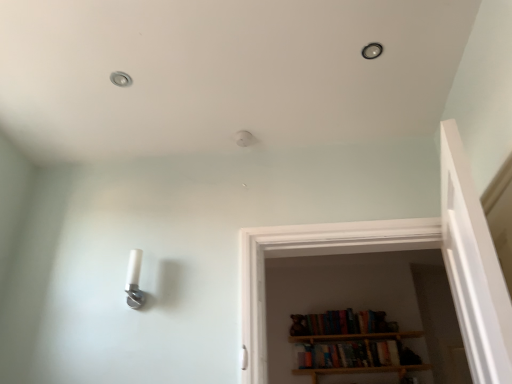
Locate an element on the screen. Image resolution: width=512 pixels, height=384 pixels. metallic ceiling light at upper left is located at coordinates (121, 79).

Image resolution: width=512 pixels, height=384 pixels. In order to click on wooden bookshelf at center in this screenshot , I will do `click(348, 354)`.

Does white plastic light fixture at lower left have a greater height compared to metallic ceiling light at upper left?

Yes.

Which is more to the right, white plastic light fixture at lower left or metallic ceiling light at upper left?

white plastic light fixture at lower left.

Which of these two, white plastic light fixture at lower left or metallic ceiling light at upper left, is bigger?

With larger size is white plastic light fixture at lower left.

Is white plastic light fixture at lower left looking in the opposite direction of metallic ceiling light at upper left?

No, white plastic light fixture at lower left's orientation is not away from metallic ceiling light at upper left.

From a real-world perspective, which is physically below, white plastic light fixture at lower left or wooden bookshelf at center?

wooden bookshelf at center is physically lower.

Is white plastic light fixture at lower left turned away from wooden bookshelf at center?

No, white plastic light fixture at lower left's orientation is not away from wooden bookshelf at center.

Between white plastic light fixture at lower left and wooden bookshelf at center, which one has smaller width?

With smaller width is white plastic light fixture at lower left.

Looking at the image, does metallic ceiling light at upper left seem bigger or smaller compared to wooden bookshelf at center?

In the image, metallic ceiling light at upper left appears to be smaller than wooden bookshelf at center.

From a real-world perspective, which is physically above, metallic ceiling light at upper left or wooden bookshelf at center?

metallic ceiling light at upper left is physically above.

Is metallic ceiling light at upper left aimed at wooden bookshelf at center?

No, metallic ceiling light at upper left is not oriented towards wooden bookshelf at center.

Is metallic ceiling light at upper left next to wooden bookshelf at center?

No, metallic ceiling light at upper left is not making contact with wooden bookshelf at center.

Is matte black light fixture at upper center positioned far away from metallic ceiling light at upper left?

No, there isn't a large distance between matte black light fixture at upper center and metallic ceiling light at upper left.

Is matte black light fixture at upper center taller or shorter than metallic ceiling light at upper left?

Considering their sizes, matte black light fixture at upper center has more height than metallic ceiling light at upper left.

From a real-world perspective, relative to metallic ceiling light at upper left, is matte black light fixture at upper center vertically above or below?

matte black light fixture at upper center is situated lower than metallic ceiling light at upper left in the real world.

Do you think metallic ceiling light at upper left is within matte black light fixture at upper center, or outside of it?

The correct answer is: outside.

Image resolution: width=512 pixels, height=384 pixels. I want to click on dot that is below the matte black light fixture at upper center (from the image's perspective), so click(121, 79).

Is metallic ceiling light at upper left further to camera compared to matte black light fixture at upper center?

Yes, metallic ceiling light at upper left is behind matte black light fixture at upper center.

Is metallic ceiling light at upper left smaller than matte black light fixture at upper center?

Indeed, metallic ceiling light at upper left has a smaller size compared to matte black light fixture at upper center.

In the scene shown: From a real-world perspective, is white plastic light fixture at lower left below matte black light fixture at upper center?

Yes.

Is white plastic light fixture at lower left turned away from matte black light fixture at upper center?

white plastic light fixture at lower left is not turned away from matte black light fixture at upper center.

Between white plastic light fixture at lower left and matte black light fixture at upper center, which one appears on the left side from the viewer's perspective?

white plastic light fixture at lower left is more to the left.

From the image's perspective, is white plastic light fixture at lower left positioned above or below matte black light fixture at upper center?

white plastic light fixture at lower left is below matte black light fixture at upper center.

Is there a large distance between wooden bookshelf at center and metallic ceiling light at upper left?

Absolutely, wooden bookshelf at center is distant from metallic ceiling light at upper left.

Could you tell me if wooden bookshelf at center is facing metallic ceiling light at upper left?

No.

Can you confirm if wooden bookshelf at center is bigger than metallic ceiling light at upper left?

Yes.

Considering the relative sizes of wooden bookshelf at center and metallic ceiling light at upper left in the image provided, is wooden bookshelf at center shorter than metallic ceiling light at upper left?

In fact, wooden bookshelf at center may be taller than metallic ceiling light at upper left.

This screenshot has height=384, width=512. In order to click on light fixture on the right of metallic ceiling light at upper left in this screenshot , I will do `click(134, 280)`.

Where is `book lying behind the white plastic light fixture at lower left`? This screenshot has height=384, width=512. book lying behind the white plastic light fixture at lower left is located at coordinates (348, 354).

When comparing their distances from wooden bookshelf at center, does white plastic light fixture at lower left or metallic ceiling light at upper left seem closer?

Based on the image, white plastic light fixture at lower left appears to be nearer to wooden bookshelf at center.

Looking at the image, which one is located further to metallic ceiling light at upper left, wooden bookshelf at center or white plastic light fixture at lower left?

wooden bookshelf at center is positioned further to the anchor metallic ceiling light at upper left.

Based on their spatial positions, is matte black light fixture at upper center or white plastic light fixture at lower left further from wooden bookshelf at center?

matte black light fixture at upper center is further to wooden bookshelf at center.

When comparing their distances from white plastic light fixture at lower left, does metallic ceiling light at upper left or wooden bookshelf at center seem closer?

metallic ceiling light at upper left is positioned closer to the anchor white plastic light fixture at lower left.

Considering their positions, is metallic ceiling light at upper left positioned further to matte black light fixture at upper center than white plastic light fixture at lower left?

white plastic light fixture at lower left.

Looking at this image, estimate the real-world distances between objects in this image. Which object is closer to white plastic light fixture at lower left, metallic ceiling light at upper left or matte black light fixture at upper center?

Based on the image, metallic ceiling light at upper left appears to be nearer to white plastic light fixture at lower left.

From the image, which object appears to be farther from white plastic light fixture at lower left, wooden bookshelf at center or metallic ceiling light at upper left?

wooden bookshelf at center is positioned further to the anchor white plastic light fixture at lower left.

Estimate the real-world distances between objects in this image. Which object is closer to matte black light fixture at upper center, white plastic light fixture at lower left or wooden bookshelf at center?

The object closer to matte black light fixture at upper center is white plastic light fixture at lower left.

You are a GUI agent. You are given a task and a screenshot of the screen. Output one action in this format:
    pyautogui.click(x=<x>, y=<y>)
    Task: Click on the dot between matte black light fixture at upper center and wooden bookshelf at center from top to bottom
    Image resolution: width=512 pixels, height=384 pixels.
    Given the screenshot: What is the action you would take?
    pyautogui.click(x=121, y=79)

The image size is (512, 384). Identify the location of light fixture between metallic ceiling light at upper left and wooden bookshelf at center from front to back. (134, 280).

I want to click on light fixture situated between metallic ceiling light at upper left and matte black light fixture at upper center from left to right, so click(x=134, y=280).

This screenshot has width=512, height=384. I want to click on light fixture positioned between matte black light fixture at upper center and wooden bookshelf at center from near to far, so click(x=134, y=280).